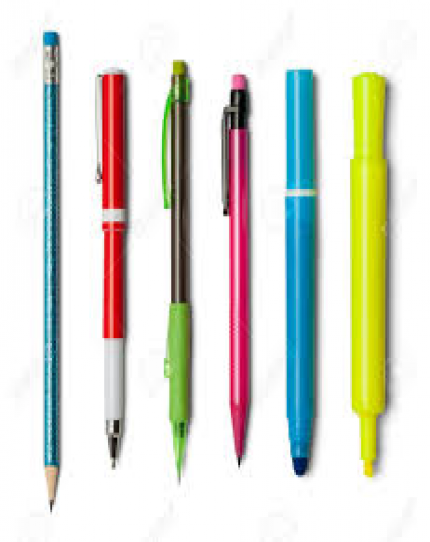
Where is `writing utensil`? The image size is (430, 542). writing utensil is located at coordinates click(x=39, y=360), click(x=111, y=341), click(x=187, y=349), click(x=246, y=359), click(x=307, y=367), click(x=386, y=358).